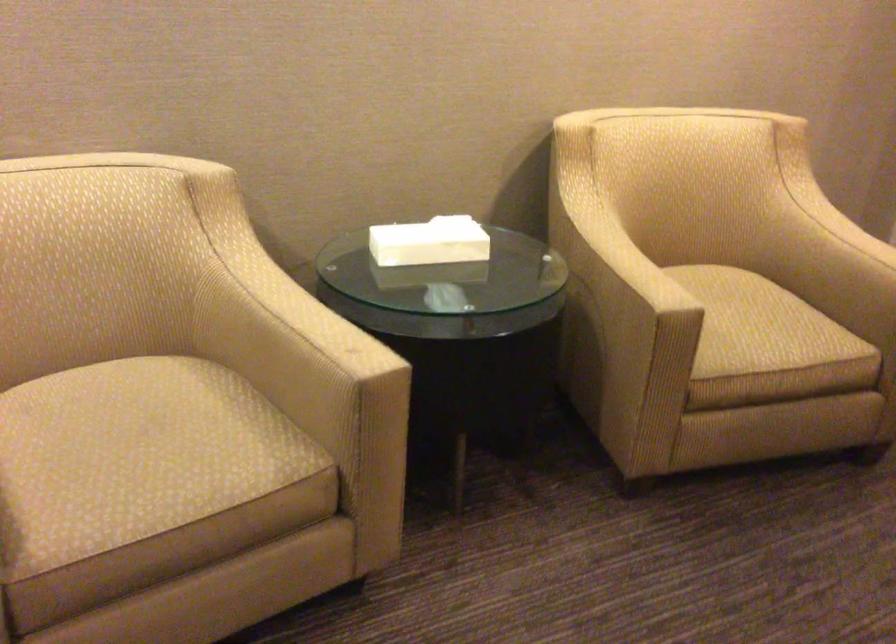
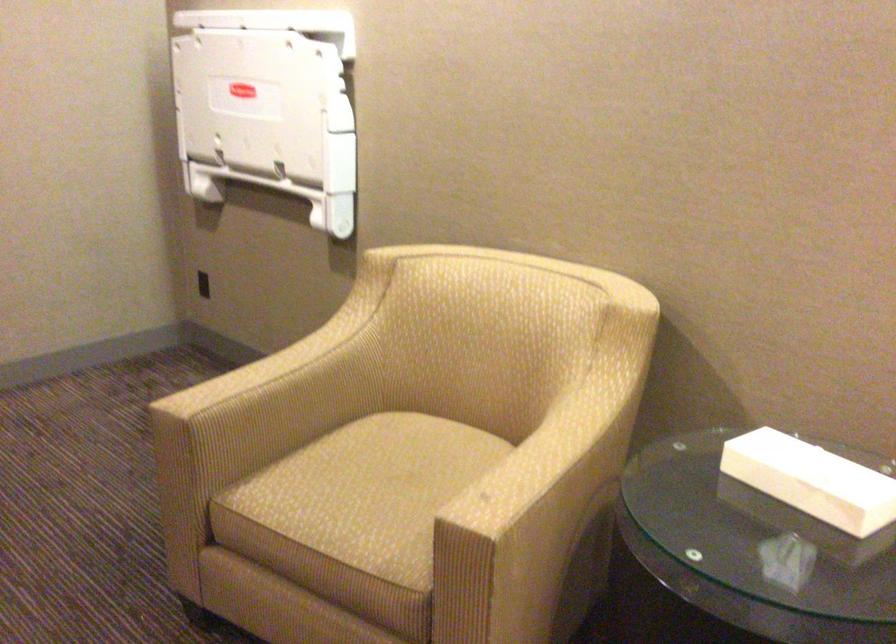
The point at (x=269, y=290) is marked in the first image. Where is the corresponding point in the second image?

(565, 426)